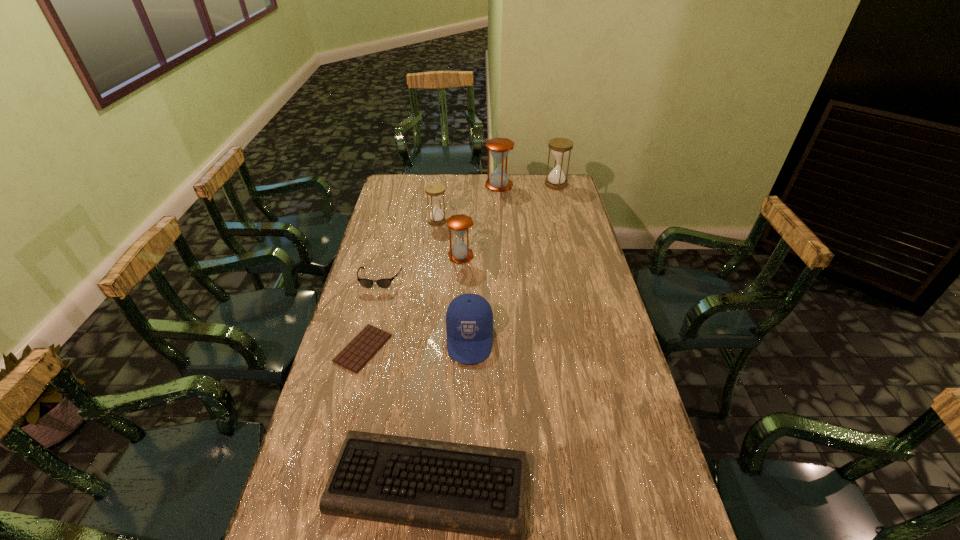
The image size is (960, 540). Identify the location of the fifth farthest object. (366, 283).

The width and height of the screenshot is (960, 540). Find the location of `the third shortest object`. the third shortest object is located at coordinates click(366, 283).

You are a GUI agent. You are given a task and a screenshot of the screen. Output one action in this format:
    pyautogui.click(x=<x>, y=<y>)
    Task: Click on the brown chocolate bar
    The width and height of the screenshot is (960, 540).
    Given the screenshot: What is the action you would take?
    pyautogui.click(x=362, y=348)

This screenshot has height=540, width=960. I want to click on chocolate bar, so click(362, 348).

Locate an element on the screen. The image size is (960, 540). vacant region located on the left of the farther brown hourglass is located at coordinates (419, 185).

Where is `vacant region located on the left of the farther white hourglass`? This screenshot has height=540, width=960. vacant region located on the left of the farther white hourglass is located at coordinates point(469,184).

Find the location of a particular element. This screenshot has height=540, width=960. vacant space located 0.120m on the right of the left white hourglass is located at coordinates (474, 220).

This screenshot has height=540, width=960. What are the coordinates of `vacant space located 0.130m on the front of the smaller brown hourglass` in the screenshot? It's located at (459, 286).

Where is `vacant region located on the front-facing side of the fourth shortest object`? The height and width of the screenshot is (540, 960). vacant region located on the front-facing side of the fourth shortest object is located at coordinates (467, 454).

The image size is (960, 540). Identify the location of free space located 0.150m on the front-facing side of the sunglasses. (369, 322).